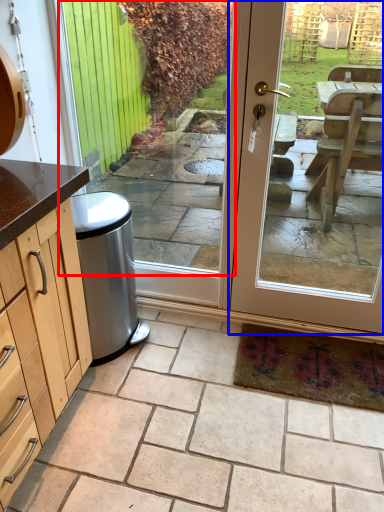
Question: Which object appears farthest to the camera in this image, window (highlighted by a red box) or door (highlighted by a blue box)?

Choices:
 (A) window
 (B) door

Answer: (A)